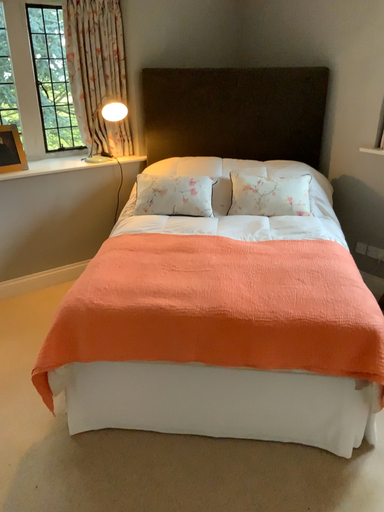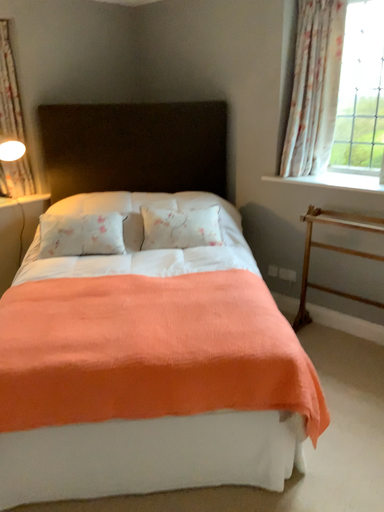
Question: Which way did the camera rotate in the video?

Choices:
 (A) rotated left
 (B) rotated right

Answer: (B)